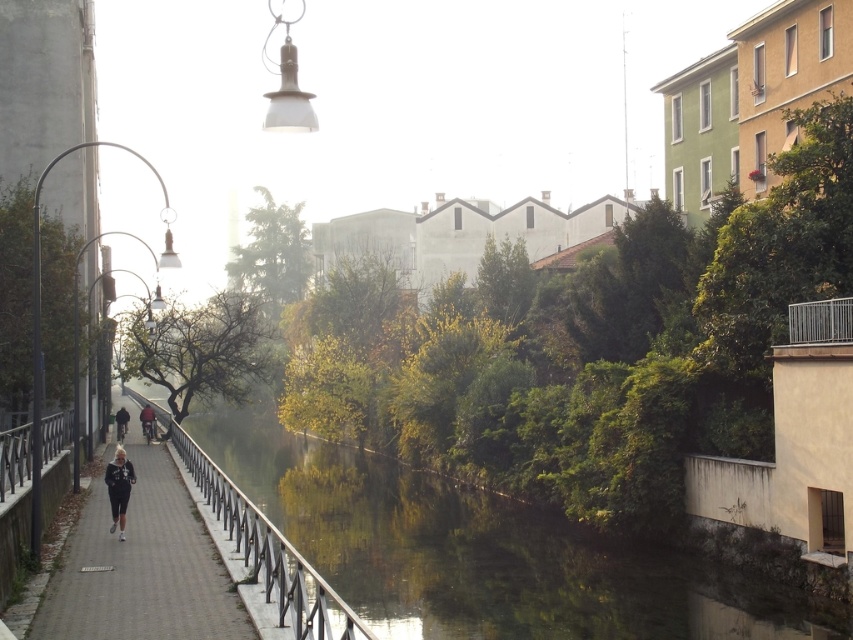
Question: Can you confirm if gray concrete pavement at center is positioned to the left of metallic gray railing at center?

Choices:
 (A) yes
 (B) no

Answer: (B)

Question: Which object appears closest to the camera in this image?

Choices:
 (A) gray concrete pavement at center
 (B) dark red fabric jacket at center
 (C) green leafy river at center

Answer: (C)

Question: Which object is the farthest from the dark gray jacket at left?

Choices:
 (A) gray concrete pavement at center
 (B) dark red fabric jacket at center
 (C) metallic gray railing at center
 (D) green leafy river at center

Answer: (A)

Question: Can you confirm if green leafy river at center is wider than dark red fabric jacket at center?

Choices:
 (A) no
 (B) yes

Answer: (B)

Question: In this image, where is gray concrete pavement at center located relative to dark gray jacket at left?

Choices:
 (A) left
 (B) right

Answer: (B)

Question: Estimate the real-world distances between objects in this image. Which object is closer to the gray concrete pavement at center?

Choices:
 (A) dark gray jacket at left
 (B) dark gray fleece jacket at center
 (C) dark red fabric jacket at center
 (D) metallic gray railing at center

Answer: (D)